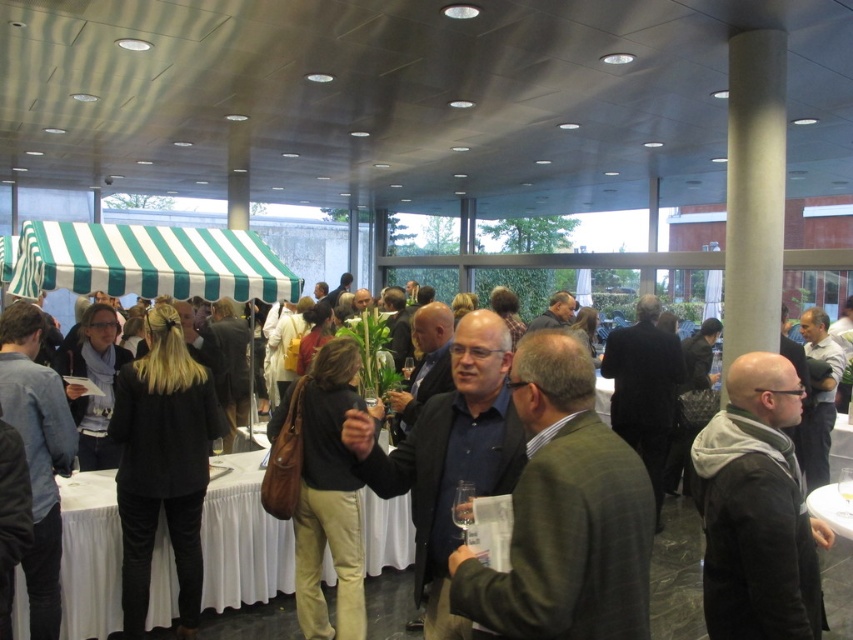
Which is more to the right, white clothed table at center or black fabric coat at center?

From the viewer's perspective, black fabric coat at center appears more on the right side.

Is point (91, 531) closer to viewer compared to point (128, 499)?

No, (91, 531) is behind (128, 499).

This screenshot has height=640, width=853. Find the location of `white clothed table at center`. white clothed table at center is located at coordinates (242, 538).

Does white clothed table at center have a greater height compared to leather handbag at center?

In fact, white clothed table at center may be shorter than leather handbag at center.

Is white clothed table at center to the right of leather handbag at center from the viewer's perspective?

No, white clothed table at center is not to the right of leather handbag at center.

You are a GUI agent. You are given a task and a screenshot of the screen. Output one action in this format:
    pyautogui.click(x=<x>, y=<y>)
    Task: Click on the white clothed table at center
    This screenshot has height=640, width=853.
    Given the screenshot: What is the action you would take?
    pyautogui.click(x=242, y=538)

Which of these two, white clothed table at center or white cloth table at lower right, stands taller?

white clothed table at center

Based on the photo, is white clothed table at center positioned in front of white cloth table at lower right?

Yes, white clothed table at center is in front of white cloth table at lower right.

This screenshot has width=853, height=640. Describe the element at coordinates (242, 538) in the screenshot. I see `white clothed table at center` at that location.

Identify the location of white clothed table at center. This screenshot has height=640, width=853. (242, 538).